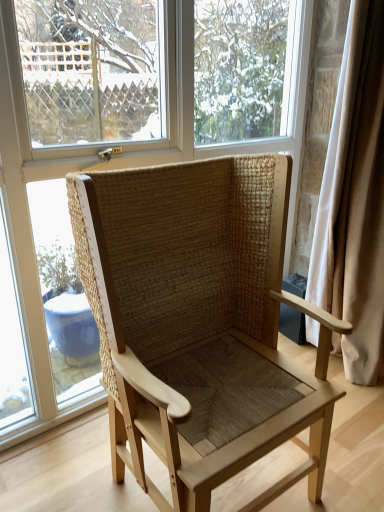
Question: From a real-world perspective, is natural woven wood chair at center physically below transparent glass window at center?

Choices:
 (A) no
 (B) yes

Answer: (B)

Question: From the image's perspective, does natural woven wood chair at center appear lower than transparent glass window at center?

Choices:
 (A) yes
 (B) no

Answer: (A)

Question: Is natural woven wood chair at center located outside transparent glass window at center?

Choices:
 (A) yes
 (B) no

Answer: (A)

Question: Is natural woven wood chair at center not close to transparent glass window at center?

Choices:
 (A) no
 (B) yes

Answer: (A)

Question: Is the position of natural woven wood chair at center less distant than that of transparent glass window at center?

Choices:
 (A) yes
 (B) no

Answer: (A)

Question: From their relative heights in the image, would you say natural woven wood chair at center is taller or shorter than white fabric curtain at right?

Choices:
 (A) short
 (B) tall

Answer: (A)

Question: Is natural woven wood chair at center to the left or to the right of white fabric curtain at right in the image?

Choices:
 (A) left
 (B) right

Answer: (A)

Question: From a real-world perspective, is natural woven wood chair at center above or below white fabric curtain at right?

Choices:
 (A) above
 (B) below

Answer: (B)

Question: Is point (144, 436) positioned closer to the camera than point (380, 45)?

Choices:
 (A) farther
 (B) closer

Answer: (B)

Question: Which is correct: transparent glass window at center is inside white fabric curtain at right, or outside of it?

Choices:
 (A) outside
 (B) inside

Answer: (A)

Question: Is transparent glass window at center taller or shorter than white fabric curtain at right?

Choices:
 (A) tall
 (B) short

Answer: (A)

Question: From a real-world perspective, is transparent glass window at center physically located above or below white fabric curtain at right?

Choices:
 (A) below
 (B) above

Answer: (B)

Question: Is transparent glass window at center to the left or to the right of white fabric curtain at right in the image?

Choices:
 (A) right
 (B) left

Answer: (B)

Question: In terms of width, does white fabric curtain at right look wider or thinner when compared to transparent glass window at center?

Choices:
 (A) wide
 (B) thin

Answer: (A)

Question: Is white fabric curtain at right inside or outside of transparent glass window at center?

Choices:
 (A) outside
 (B) inside

Answer: (A)